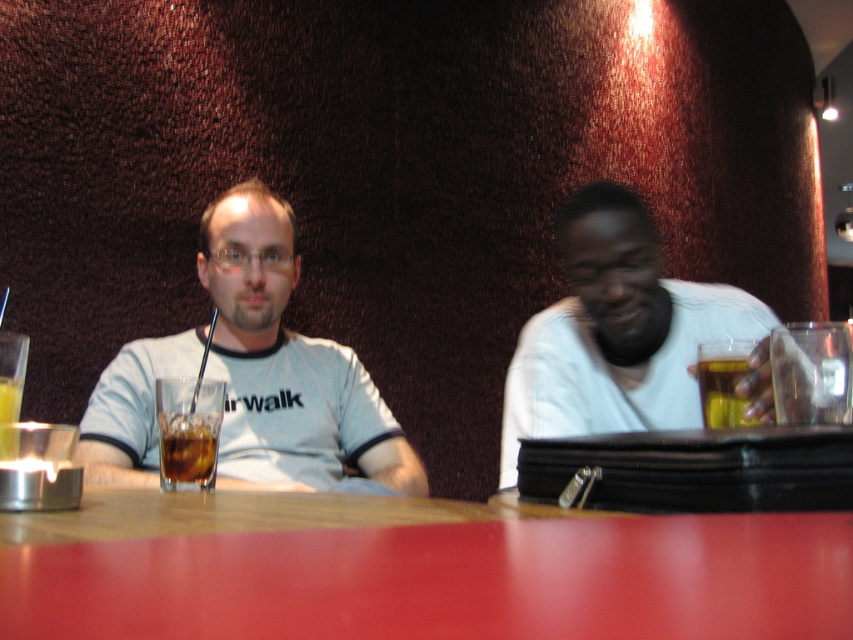
You are standing behind the white matte shirt at right and want to place a small item on the smooth wooden table at center. Can you reach the table without moving your position?

The smooth wooden table at center is in front of the white matte shirt at right, so you can reach the table without moving your position.

You are standing in the middle of the room and want to place a small plant pot on the smooth wooden table at center. According to the coordinates provided, where should you move to reach the table?

The smooth wooden table at center is located at point (415,570), so you should move to that coordinate to place the plant pot there.

You are standing at the entrance of the cafe and want to sit at the smooth wooden table at center. The point you need to reach is marked at coordinates point (x=415, y=570). Can you walk directly to that point without moving around any obstacles?

The point (x=415, y=570) is on the smooth wooden table at center, so yes, you can walk directly to that point without moving around any obstacles because it is on the table itself.